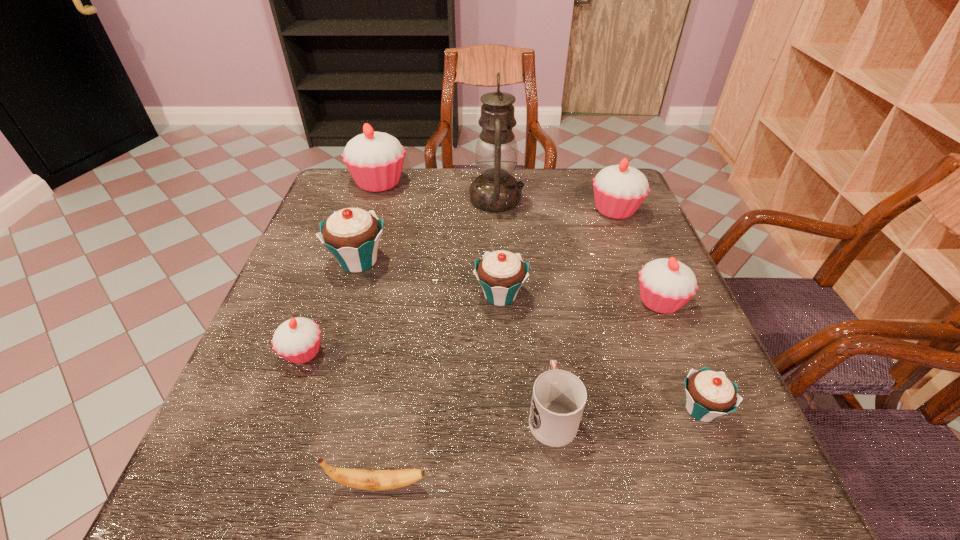
At what (x,y) coordinates should I click in order to perform the action: click on pink cupcake that is the second closest to the tallest object. Please return your answer as a coordinate pair (x, y). The height and width of the screenshot is (540, 960). Looking at the image, I should click on (375, 160).

You are a GUI agent. You are given a task and a screenshot of the screen. Output one action in this format:
    pyautogui.click(x=<x>, y=<y>)
    Task: Click on the pink cupcake that is the fourth closest to the oil lamp
    The width and height of the screenshot is (960, 540).
    Given the screenshot: What is the action you would take?
    pyautogui.click(x=297, y=340)

Select which teal cupcake appears as the third closest to the second smallest pink cupcake. Please provide its 2D coordinates. Your answer should be formatted as a tuple, i.e. [(x, y)], where the tuple contains the x and y coordinates of a point satisfying the conditions above.

[(352, 235)]

Identify which teal cupcake is the second nearest to the yellow banana. Please provide its 2D coordinates. Your answer should be formatted as a tuple, i.e. [(x, y)], where the tuple contains the x and y coordinates of a point satisfying the conditions above.

[(709, 394)]

At what (x,y) coordinates should I click in order to perform the action: click on free space that satisfies the following two spatial constraints: 1. on the back side of the oil lamp; 2. on the right side of the biggest teal cupcake. Please return your answer as a coordinate pair (x, y). The height and width of the screenshot is (540, 960). Looking at the image, I should click on (377, 199).

The width and height of the screenshot is (960, 540). I want to click on free space that satisfies the following two spatial constraints: 1. on the side of the nearest teal cupcake where the handle is located; 2. on the right side of the cup, so click(x=551, y=409).

What are the coordinates of `vacant space that satisfies the following two spatial constraints: 1. on the side of the red cup where the handle is located; 2. on the right side of the smallest teal cupcake` in the screenshot? It's located at (551, 409).